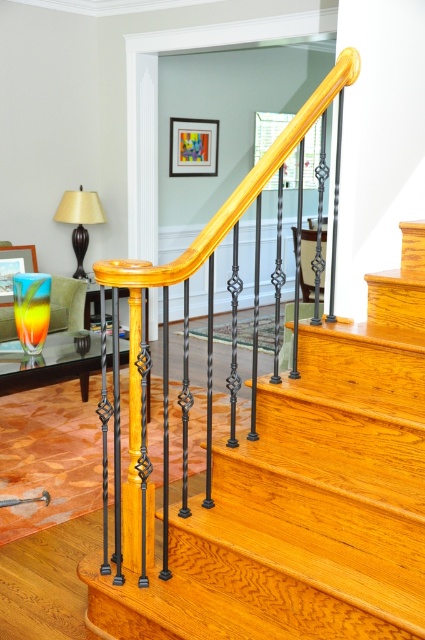
You are a delivery person carrying a large box that is 1.2 meters wide. You need to navigate through the space between the matte wood stairs at center and the matte black lampshade at left. Can your box fit through this space?

The matte wood stairs at center is wider than the matte black lampshade at left. Therefore, the total width available between them may not be sufficient for a box that is 1.2 meters wide. You should check the exact dimensions before attempting to move the box through this area.

You are moving a large painting and need to know which object in the scene is bigger. Which one is larger, the matte wood stairs at center or the matte black lampshade at left?

The matte wood stairs at center is larger in size than the matte black lampshade at left according to the description.

You are a delivery person carrying a box that is 1.2 meters tall. You need to place it in the room where the matte wood stairs at center and the matte black lampshade at left are located. Can the box fit vertically in this room without touching the ceiling?

The matte wood stairs at center is taller than the matte black lampshade at left. Since the stairs are taller, the height of the room is at least as tall as the stairs. However, the box is 1.2 meters tall. Without knowing the exact height of the stairs or the room, we cannot determine if the box will fit vertically without touching the ceiling.